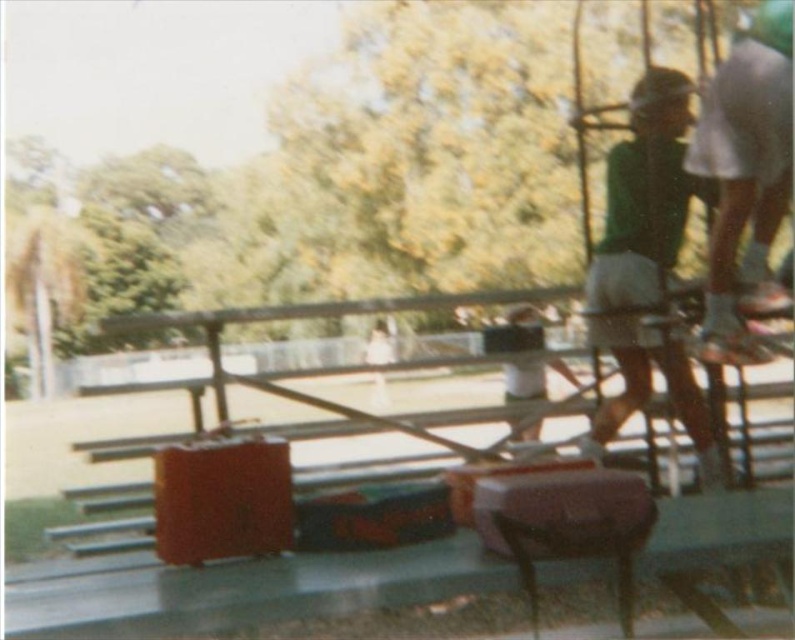
Question: Where is green fabric shirt at right located in relation to green fabric shirt at center in the image?

Choices:
 (A) above
 (B) below

Answer: (A)

Question: Considering the relative positions of green fabric shirt at right and green fabric shirt at center in the image provided, where is green fabric shirt at right located with respect to green fabric shirt at center?

Choices:
 (A) above
 (B) below

Answer: (A)

Question: Among these points, which one is farthest from the camera?

Choices:
 (A) (588, 280)
 (B) (520, 433)

Answer: (B)

Question: Does green fabric shirt at right have a greater width compared to green fabric shirt at center?

Choices:
 (A) yes
 (B) no

Answer: (B)